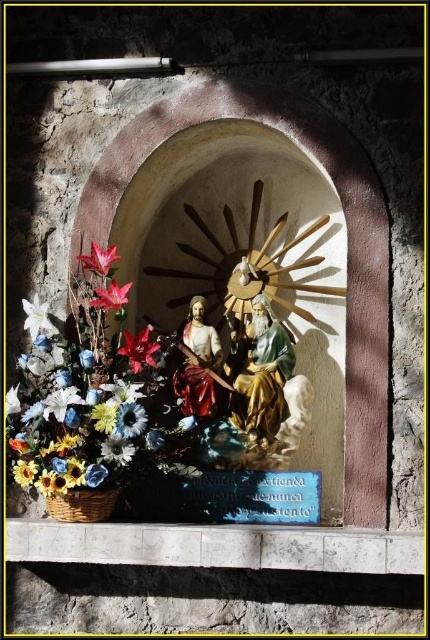
Which of these two, multicolored artificial flowers at left or gold painted wood statue at center, stands taller?

With more height is multicolored artificial flowers at left.

Can you confirm if multicolored artificial flowers at left is thinner than gold painted wood statue at center?

Incorrect, multicolored artificial flowers at left's width is not less than gold painted wood statue at center's.

Measure the distance between point (128, 467) and camera.

They are 2.00 meters apart.

Where is `multicolored artificial flowers at left`? multicolored artificial flowers at left is located at coordinates (89, 403).

Which is more to the left, sunflowersmoothflower at lower left or yellow matte sunflower at lower left?

yellow matte sunflower at lower left

Where is `sunflowersmoothflower at lower left`? Image resolution: width=430 pixels, height=640 pixels. sunflowersmoothflower at lower left is located at coordinates (116, 449).

Between matte sunflower at lower left and yellow matte sunflower at lower left, which one has more height?

matte sunflower at lower left is taller.

Who is shorter, matte sunflower at lower left or yellow matte sunflower at lower left?

Standing shorter between the two is yellow matte sunflower at lower left.

Does point (43, 400) lie behind point (25, 465)?

Yes, it is.

Identify the location of matte sunflower at lower left. The width and height of the screenshot is (430, 640). (61, 401).